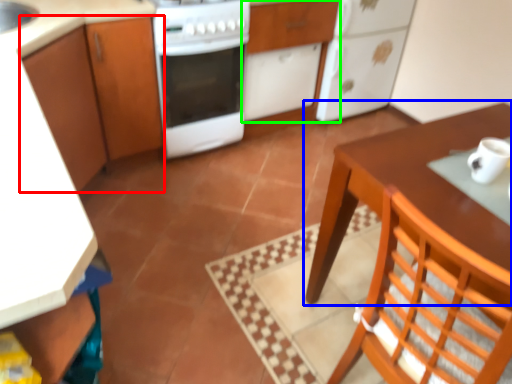
Question: Which is farther away from cabinetry (highlighted by a red box)? table (highlighted by a blue box) or cabinetry (highlighted by a green box)?

Choices:
 (A) table
 (B) cabinetry

Answer: (A)